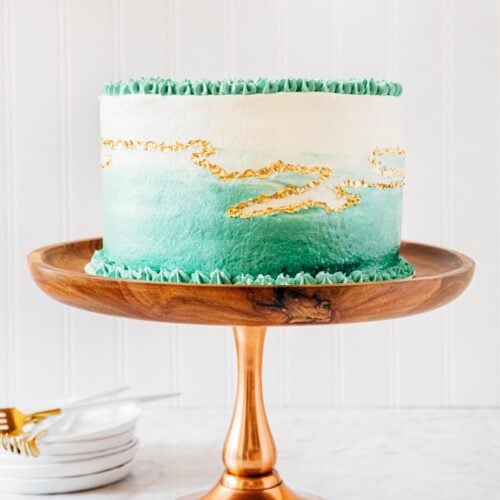
This screenshot has height=500, width=500. Identify the location of handle. (86, 405), (64, 418).